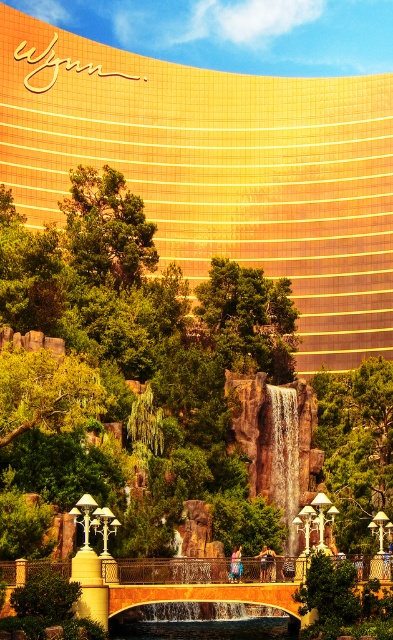
Question: Is gold metallic building at upper center bigger than golden metallic waterfall at center?

Choices:
 (A) no
 (B) yes

Answer: (B)

Question: Which point appears closest to the camera in this image?

Choices:
 (A) (268, 390)
 (B) (121, 108)

Answer: (A)

Question: Which object is closer to the camera taking this photo?

Choices:
 (A) gold metallic building at upper center
 (B) golden metallic waterfall at center

Answer: (B)

Question: Does gold metallic building at upper center have a larger size compared to golden metallic waterfall at center?

Choices:
 (A) no
 (B) yes

Answer: (B)

Question: Is gold metallic building at upper center above golden metallic waterfall at center?

Choices:
 (A) no
 (B) yes

Answer: (B)